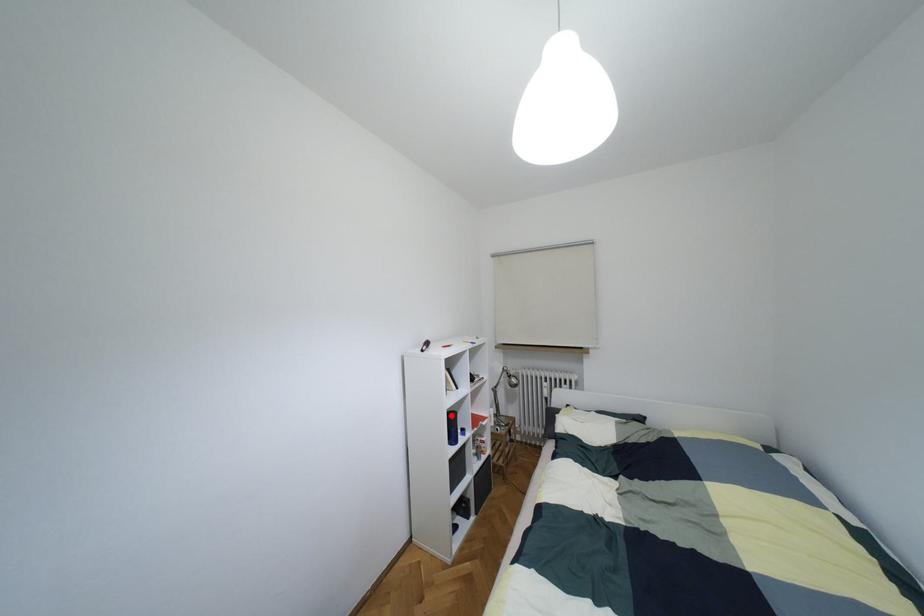
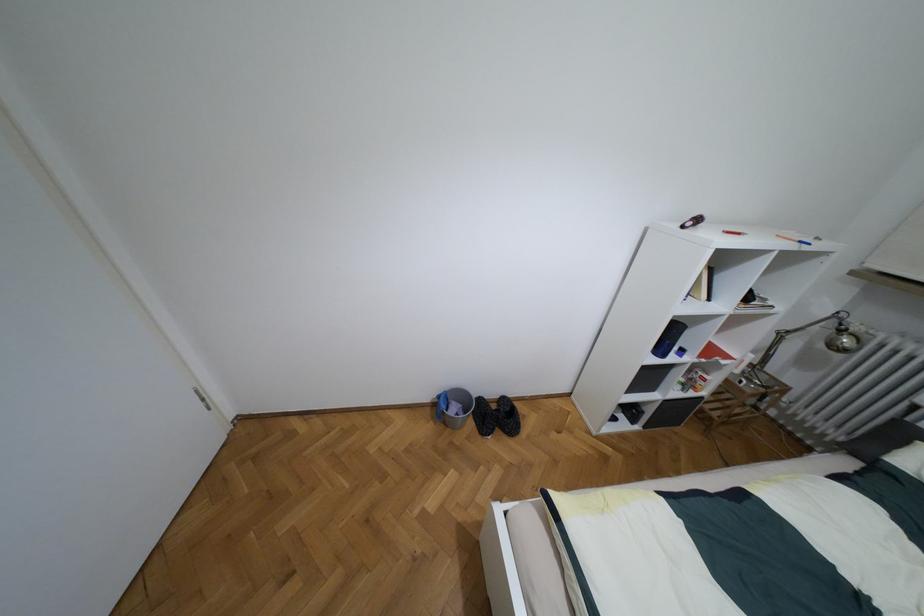
The point at the highlighted location is marked in the first image. Where is the corresponding point in the second image?

(675, 326)